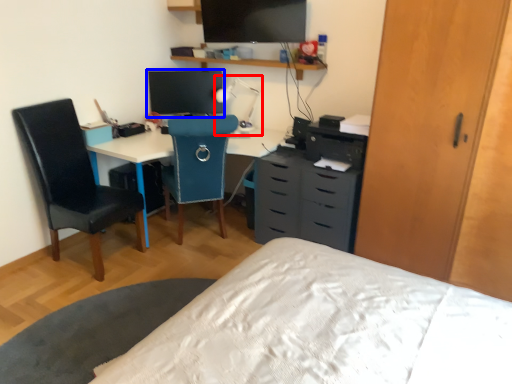
Question: Which of the following is the closest to the observer, table lamp (highlighted by a red box) or computer monitor (highlighted by a blue box)?

Choices:
 (A) table lamp
 (B) computer monitor

Answer: (A)